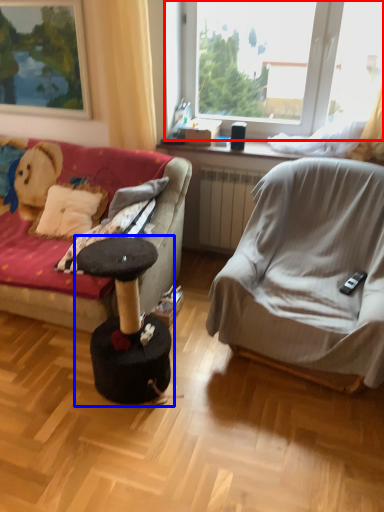
Question: Which object is further to the camera taking this photo, window (highlighted by a red box) or music stool (highlighted by a blue box)?

Choices:
 (A) window
 (B) music stool

Answer: (A)